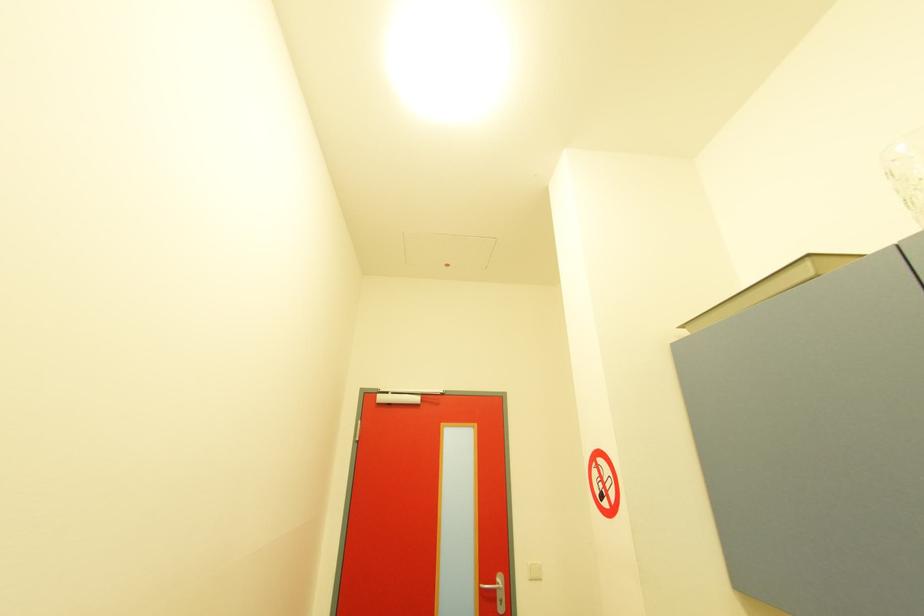
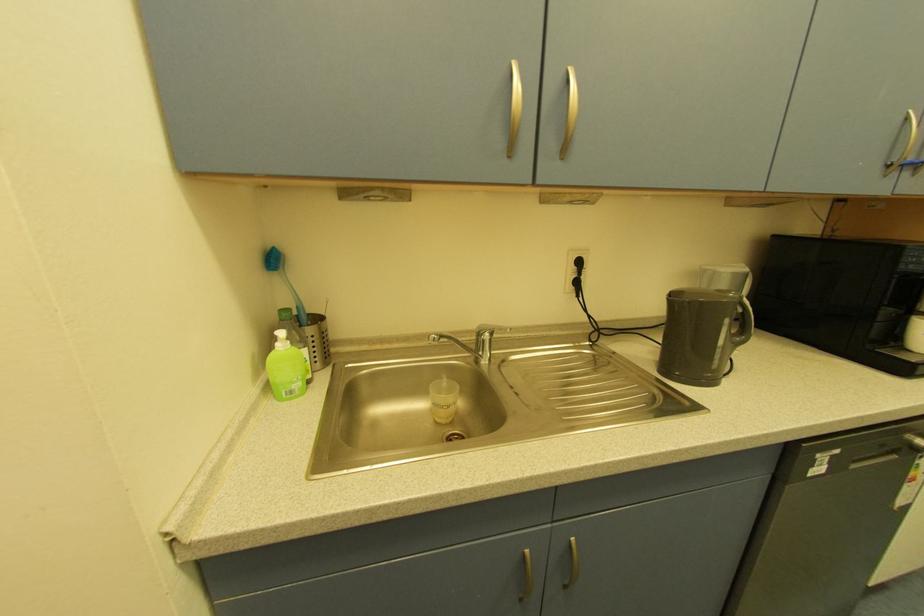
Question: The camera is either moving clockwise (left) or counter-clockwise (right) around the object. The first image is from the beginning of the video and the second image is from the end. Is the camera moving left or right when shooting the video?

Choices:
 (A) Left
 (B) Right

Answer: (A)